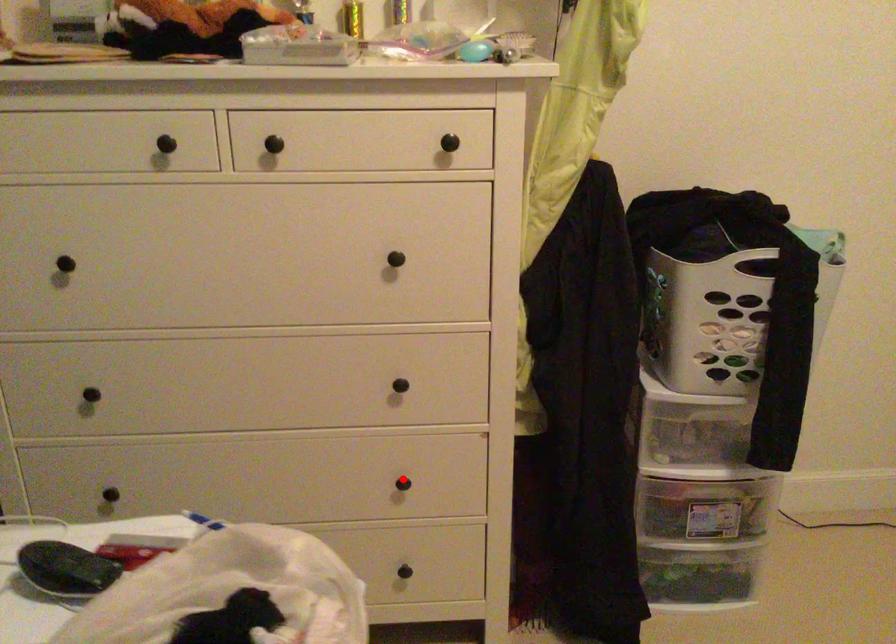
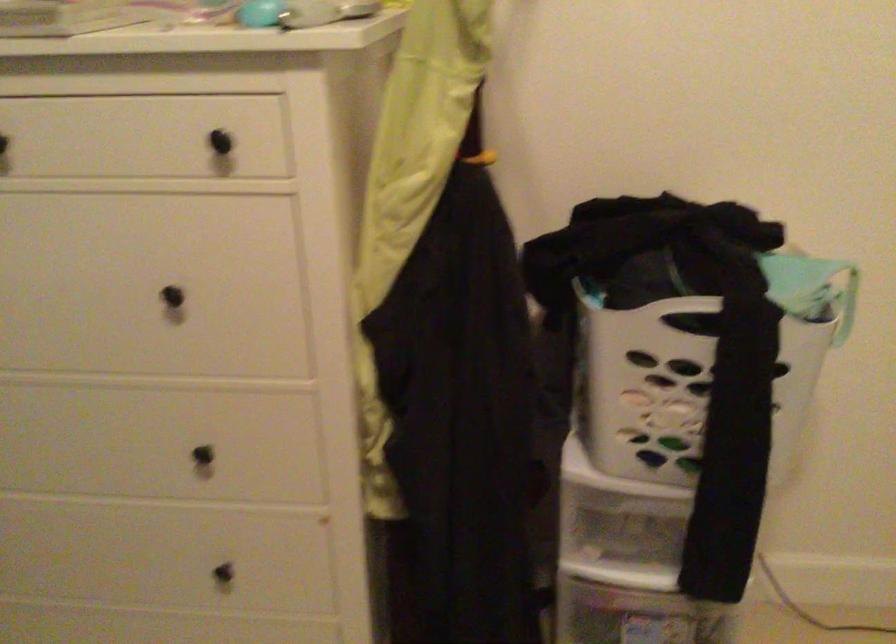
Question: I am providing you with two images of the same scene from different viewpoints. In image1, a red point is highlighted. Considering the same 3D point in image2, which of the following is correct?

Choices:
 (A) It is closer
 (B) It is farther

Answer: (A)